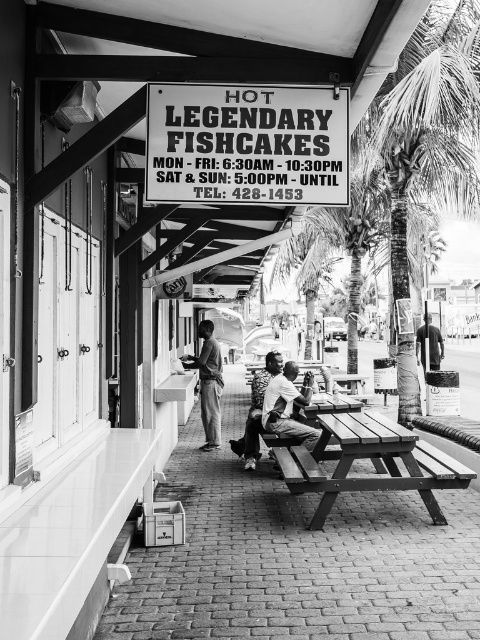
You are a customer waiting to order fishcakes. You see a wooden picnic table at center and a dark skin textured shirt at center. Which object is closer to the ground?

The wooden picnic table at center is shorter than the dark skin textured shirt at center, so the wooden picnic table at center is closer to the ground.

What is the spatial relationship between the wooden picnic table at center and the dark skin textured shirt at center in the image?

The wooden picnic table at center is to the right of the dark skin textured shirt at center.

You are taking a photo of the street scene and want to focus on both the point at (203, 180) and the point at (354, 426). Which point should you adjust your focus to first to ensure both are in sharp view?

You should focus on point (203, 180) first because it is closer to the camera than point (354, 426). By focusing on the closer point, the farther point will also be in focus due to the depth of field.